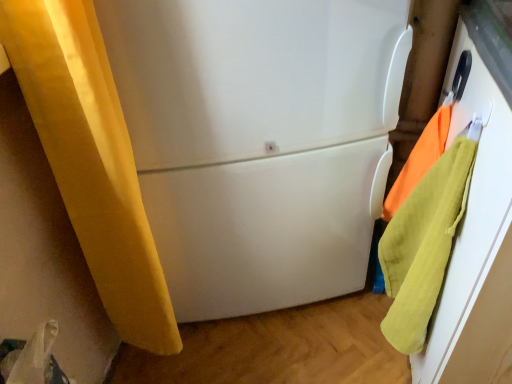
Question: Relative to orange cotton towel at right, which appears as the 2th beach towel when ordered from the bottom, is white glossy refrigerator at center in front or behind?

Choices:
 (A) behind
 (B) front

Answer: (B)

Question: In terms of size, does white glossy refrigerator at center appear bigger or smaller than orange cotton towel at right, which appears as the 2th beach towel when ordered from the bottom?

Choices:
 (A) big
 (B) small

Answer: (A)

Question: Based on their relative distances, which object is nearer to the soft yellow towel at right, marked as the second beach towel in a top-to-bottom arrangement?

Choices:
 (A) white glossy refrigerator at center
 (B) orange cotton towel at right, which is the 1th beach towel from top to bottom

Answer: (B)

Question: Estimate the real-world distances between objects in this image. Which object is closer to the soft yellow towel at right, marked as the second beach towel in a top-to-bottom arrangement?

Choices:
 (A) white glossy refrigerator at center
 (B) orange cotton towel at right, which appears as the 2th beach towel when ordered from the bottom

Answer: (B)